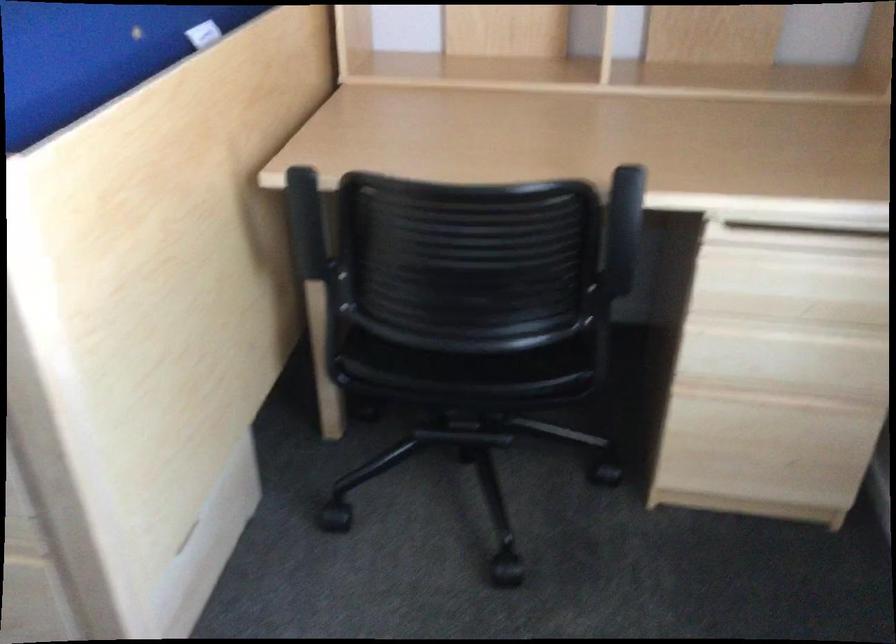
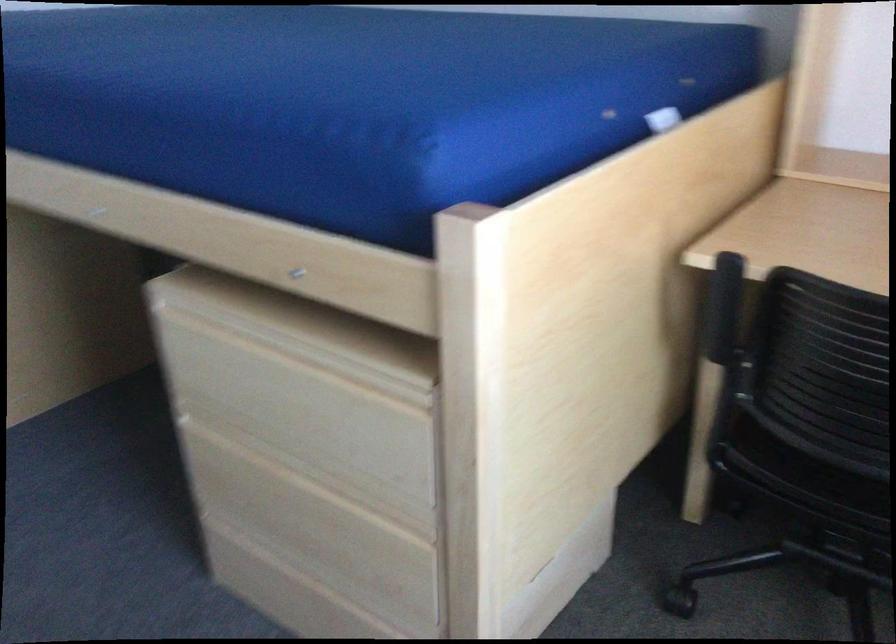
Question: How did the camera likely rotate?

Choices:
 (A) Left
 (B) Right
 (C) Up
 (D) Down

Answer: (A)